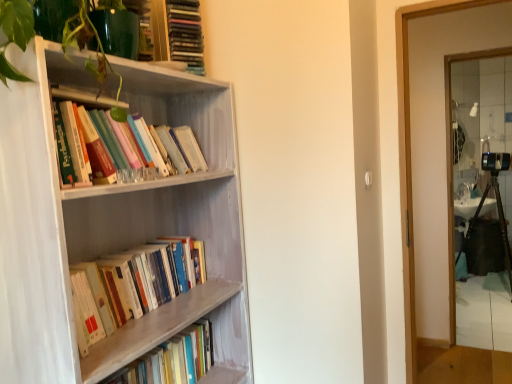
Question: Does wooden book at left, the 4th book viewed from the top, appear on the left side of clear glass mirror at right?

Choices:
 (A) no
 (B) yes

Answer: (B)

Question: From a real-world perspective, is wooden book at left, which is the 1th book from bottom to top, beneath clear glass mirror at right?

Choices:
 (A) yes
 (B) no

Answer: (A)

Question: Is wooden book at left, the 4th book viewed from the top, thinner than clear glass mirror at right?

Choices:
 (A) no
 (B) yes

Answer: (A)

Question: Is wooden book at left, which is the 1th book from bottom to top, bigger than clear glass mirror at right?

Choices:
 (A) yes
 (B) no

Answer: (B)

Question: Considering the relative positions of wooden book at left, the 4th book viewed from the top, and clear glass mirror at right in the image provided, is wooden book at left, the 4th book viewed from the top, in front of clear glass mirror at right?

Choices:
 (A) no
 (B) yes

Answer: (B)

Question: Does wooden book at left, the 4th book viewed from the top, have a lesser height compared to clear glass mirror at right?

Choices:
 (A) no
 (B) yes

Answer: (B)

Question: Is wooden book at left, which is the 1th book from bottom to top, completely or partially inside matte plastic books at upper center, the 1th book viewed from the top?

Choices:
 (A) no
 (B) yes

Answer: (A)

Question: Is matte plastic books at upper center, acting as the 4th book starting from the bottom, oriented towards wooden book at left, which is the 1th book from bottom to top?

Choices:
 (A) no
 (B) yes

Answer: (A)

Question: Considering the relative positions of matte plastic books at upper center, the 1th book viewed from the top, and wooden book at left, the 4th book viewed from the top, in the image provided, is matte plastic books at upper center, the 1th book viewed from the top, in front of wooden book at left, the 4th book viewed from the top,?

Choices:
 (A) no
 (B) yes

Answer: (A)

Question: From a real-world perspective, is matte plastic books at upper center, the 1th book viewed from the top, beneath wooden book at left, which is the 1th book from bottom to top?

Choices:
 (A) yes
 (B) no

Answer: (B)

Question: Is matte plastic books at upper center, acting as the 4th book starting from the bottom, further to camera compared to wooden book at left, which is the 1th book from bottom to top?

Choices:
 (A) yes
 (B) no

Answer: (A)

Question: Is matte plastic books at upper center, the 1th book viewed from the top, smaller than wooden book at left, the 4th book viewed from the top?

Choices:
 (A) no
 (B) yes

Answer: (B)

Question: Is wooden bookcase at left further to the viewer compared to clear glass mirror at right?

Choices:
 (A) no
 (B) yes

Answer: (A)